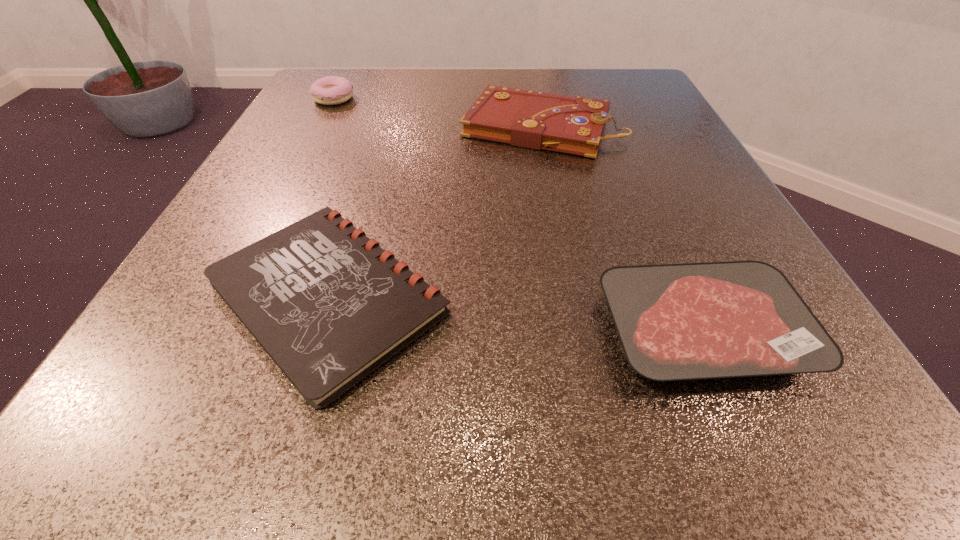
The width and height of the screenshot is (960, 540). I want to click on steak present at the near edge, so click(x=690, y=321).

Locate an element on the screen. This screenshot has height=540, width=960. notebook that is at the near edge is located at coordinates (329, 306).

This screenshot has width=960, height=540. Find the location of `doughnut that is at the left edge`. doughnut that is at the left edge is located at coordinates (331, 90).

Locate an element on the screen. This screenshot has height=540, width=960. notebook present at the left edge is located at coordinates (329, 306).

Locate an element on the screen. The height and width of the screenshot is (540, 960). notebook situated at the right edge is located at coordinates (538, 120).

Image resolution: width=960 pixels, height=540 pixels. I want to click on steak present at the right edge, so click(690, 321).

You are a GUI agent. You are given a task and a screenshot of the screen. Output one action in this format:
    pyautogui.click(x=<x>, y=<y>)
    Task: Click on the object present at the far left corner
    
    Given the screenshot: What is the action you would take?
    pyautogui.click(x=331, y=90)

Find the location of a particular element. The width and height of the screenshot is (960, 540). object present at the near left corner is located at coordinates (329, 306).

Find the location of `object at the far right corner`. object at the far right corner is located at coordinates (538, 120).

The height and width of the screenshot is (540, 960). What are the coordinates of `object situated at the near right corner` in the screenshot? It's located at (690, 321).